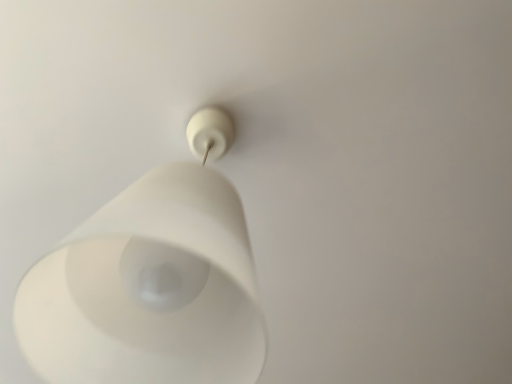
From the picture: What is the approximate height of matte white lampshade at upper left?

22.80 inches.

The width and height of the screenshot is (512, 384). I want to click on matte white lampshade at upper left, so click(152, 282).

Measure the distance between point (x=196, y=319) and camera.

The depth of point (x=196, y=319) is 19.84 inches.

Describe the element at coordinates (152, 282) in the screenshot. This screenshot has width=512, height=384. I see `matte white lampshade at upper left` at that location.

Where is `matte white lampshade at upper left`? matte white lampshade at upper left is located at coordinates (152, 282).